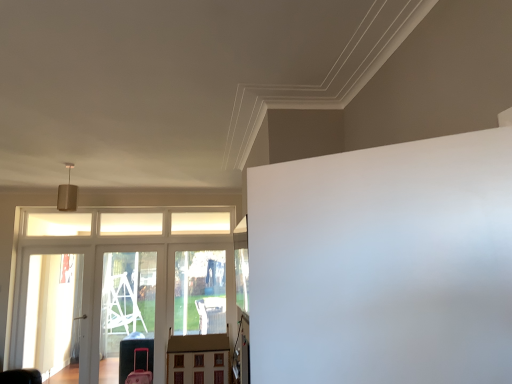
Question: Does transparent plastic screen door at left, which is the second screen door from left to right, have a greater width compared to wooden dollhouse at center?

Choices:
 (A) yes
 (B) no

Answer: (B)

Question: Does transparent plastic screen door at left, which is the second screen door from left to right, appear on the left side of wooden dollhouse at center?

Choices:
 (A) yes
 (B) no

Answer: (A)

Question: Is the position of transparent plastic screen door at left, which ranks as the first screen door in right-to-left order, more distant than that of wooden dollhouse at center?

Choices:
 (A) no
 (B) yes

Answer: (B)

Question: Does transparent plastic screen door at left, which is the second screen door from left to right, appear on the right side of wooden dollhouse at center?

Choices:
 (A) no
 (B) yes

Answer: (A)

Question: From the image's perspective, would you say transparent plastic screen door at left, which is the second screen door from left to right, is positioned over wooden dollhouse at center?

Choices:
 (A) yes
 (B) no

Answer: (A)

Question: From a real-world perspective, is transparent plastic screen door at left, which is the second screen door from left to right, positioned over wooden dollhouse at center based on gravity?

Choices:
 (A) no
 (B) yes

Answer: (B)

Question: Can you confirm if transparent plastic elevator at lower left is thinner than wooden dollhouse at center?

Choices:
 (A) yes
 (B) no

Answer: (A)

Question: From a real-world perspective, is transparent plastic elevator at lower left physically above wooden dollhouse at center?

Choices:
 (A) no
 (B) yes

Answer: (B)

Question: Could you tell me if transparent plastic elevator at lower left is facing wooden dollhouse at center?

Choices:
 (A) no
 (B) yes

Answer: (B)

Question: Are transparent plastic elevator at lower left and wooden dollhouse at center beside each other?

Choices:
 (A) no
 (B) yes

Answer: (A)

Question: Can you confirm if transparent plastic elevator at lower left is positioned to the left of wooden dollhouse at center?

Choices:
 (A) no
 (B) yes

Answer: (B)

Question: Can you confirm if transparent plastic elevator at lower left is smaller than wooden dollhouse at center?

Choices:
 (A) no
 (B) yes

Answer: (A)

Question: Is transparent plastic screen door at left, which ranks as the first screen door in right-to-left order, positioned with its back to transparent glass screen door at left, the 2th screen door in the right-to-left sequence?

Choices:
 (A) yes
 (B) no

Answer: (B)